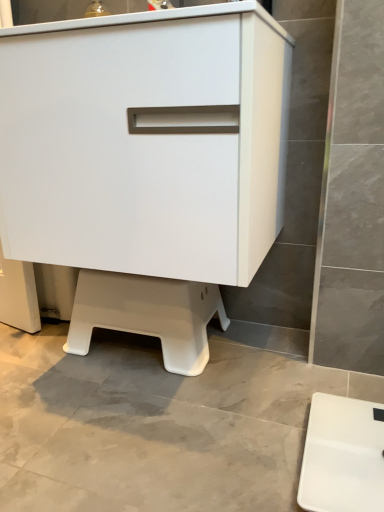
Question: From a real-world perspective, relative to white plastic step stool at lower center, is white matte cabinet at center vertically above or below?

Choices:
 (A) above
 (B) below

Answer: (A)

Question: Relative to white plastic step stool at lower center, is white matte cabinet at center in front or behind?

Choices:
 (A) behind
 (B) front

Answer: (B)

Question: Which object is the closest to the white plastic step stool at lower center?

Choices:
 (A) white matte cabinet at center
 (B) white plastic scale at lower right

Answer: (A)

Question: Estimate the real-world distances between objects in this image. Which object is farther from the white plastic scale at lower right?

Choices:
 (A) white matte cabinet at center
 (B) white plastic step stool at lower center

Answer: (A)